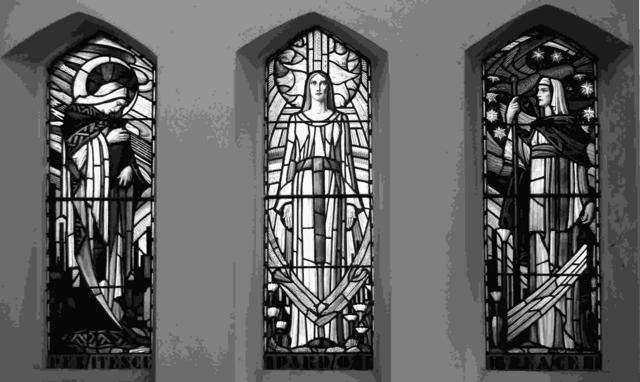
The height and width of the screenshot is (382, 640). Identify the location of wall. (203, 12).